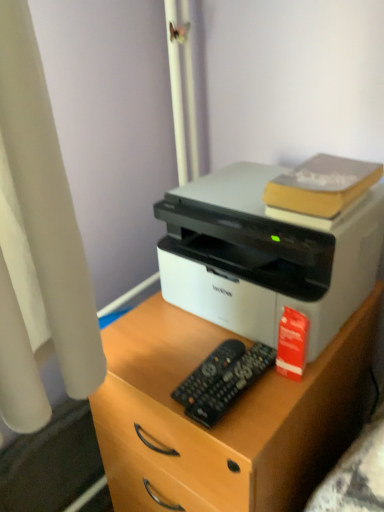
Find the location of `vacant point to the left of red matte book at right, the 1th book ordered from the bottom`. vacant point to the left of red matte book at right, the 1th book ordered from the bottom is located at coordinates (193, 368).